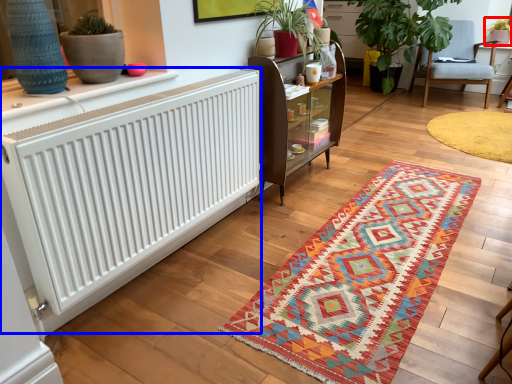
Question: Which object is closer to the camera taking this photo, houseplant (highlighted by a red box) or radiator (highlighted by a blue box)?

Choices:
 (A) houseplant
 (B) radiator

Answer: (B)